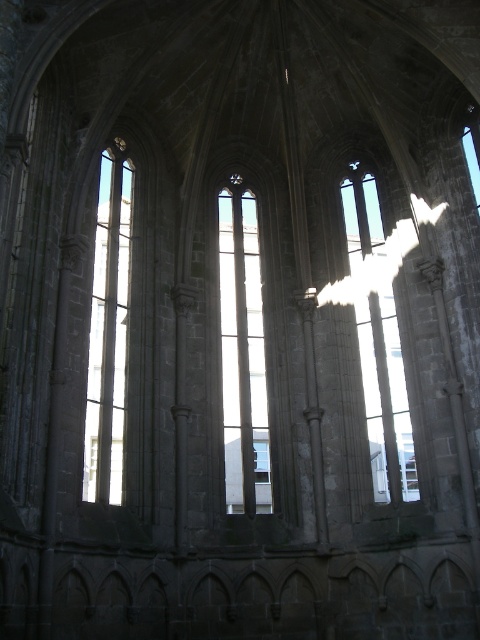
You are standing inside a historic stone structure and notice a point marked at coordinates (x=242, y=355). Based on the scene description, what object does this point most likely correspond to?

The point at coordinates (x=242, y=355) corresponds to the clear glass window at center.

You are an architect examining the Gothic structure. You notice the transparent glass window at center and the clear glass window at left. Which window takes up more area in the image?

The clear glass window at left occupies more space than the transparent glass window at center, so it takes up more area in the image.